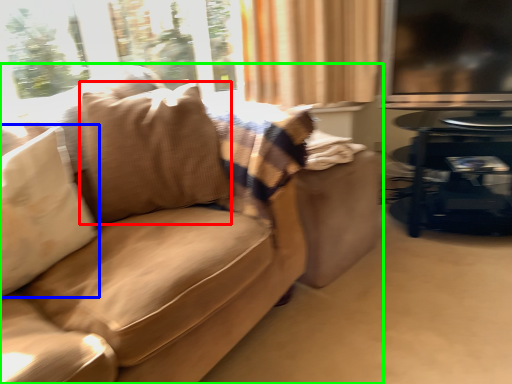
Question: Which is nearer to the throw pillow (highlighted by a red box)? pillow (highlighted by a blue box) or studio couch (highlighted by a green box).

Choices:
 (A) pillow
 (B) studio couch

Answer: (B)